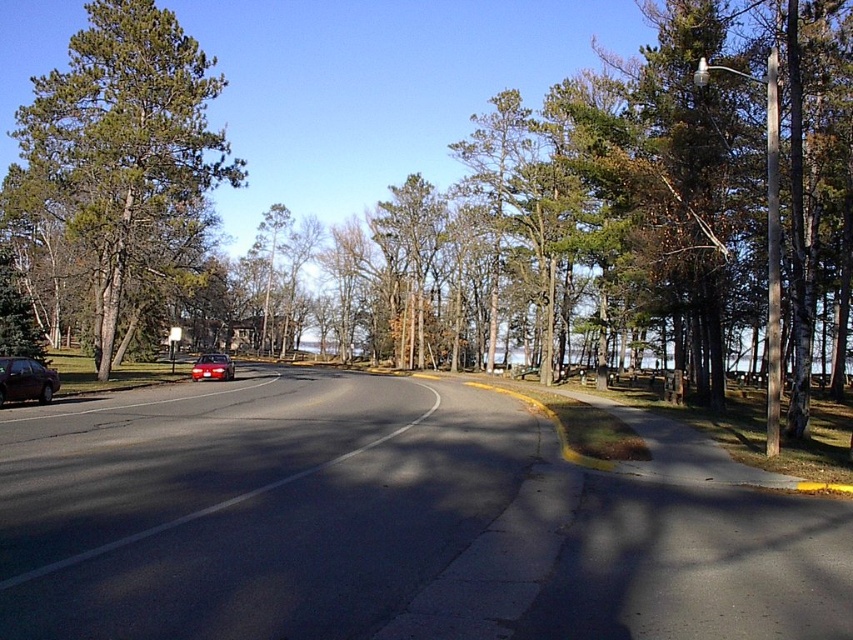
Question: Which object is the closest to the shiny red car at center?

Choices:
 (A) shiny dark brown sedan at left
 (B) green matte tree at left

Answer: (B)

Question: Which of these objects is positioned farthest from the shiny red car at center?

Choices:
 (A) shiny dark brown sedan at left
 (B) green matte tree at left

Answer: (A)

Question: Is green matte tree at left above shiny red car at center?

Choices:
 (A) no
 (B) yes

Answer: (B)

Question: Is green matte tree at left above shiny dark brown sedan at left?

Choices:
 (A) no
 (B) yes

Answer: (B)

Question: Does shiny dark brown sedan at left have a greater width compared to shiny red car at center?

Choices:
 (A) yes
 (B) no

Answer: (B)

Question: Which is nearer to the shiny dark brown sedan at left?

Choices:
 (A) green matte tree at left
 (B) shiny red car at center

Answer: (B)